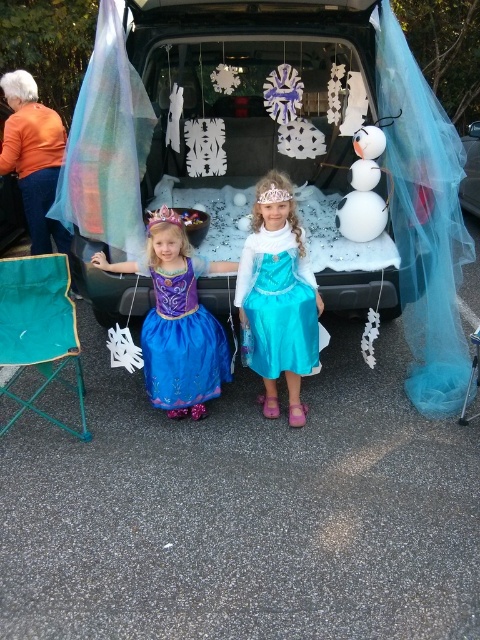
Is matte purple dress at left further to the viewer compared to turquoise satin dress at center?

No, it is not.

Measure the distance between matte purple dress at left and turquoise satin dress at center.

12.61 inches

Is point (171, 362) positioned after point (268, 260)?

Yes, it is.

Where is `matte purple dress at left`? The width and height of the screenshot is (480, 640). matte purple dress at left is located at coordinates (178, 321).

Is turquoise satin dress at center closer to camera compared to blue satin dress at center?

Yes, it is.

Consider the image. Is turquoise satin dress at center bigger than blue satin dress at center?

Correct, turquoise satin dress at center is larger in size than blue satin dress at center.

Based on the photo, who is more distant from viewer, (247, 237) or (197, 349)?

The point (247, 237) is behind.

Find the location of a particular element. turquoise satin dress at center is located at coordinates (277, 305).

You are a GUI agent. You are given a task and a screenshot of the screen. Output one action in this format:
    pyautogui.click(x=<x>, y=<y>)
    Task: Click on the matte purple dress at left
    This screenshot has height=640, width=480.
    Given the screenshot: What is the action you would take?
    pyautogui.click(x=178, y=321)

Between point (180, 230) and point (220, 365), which one is positioned in front?

Point (180, 230)

Is point (172, 257) positioned after point (227, 340)?

No, (172, 257) is closer to viewer.

This screenshot has height=640, width=480. In order to click on matte purple dress at left in this screenshot , I will do `click(178, 321)`.